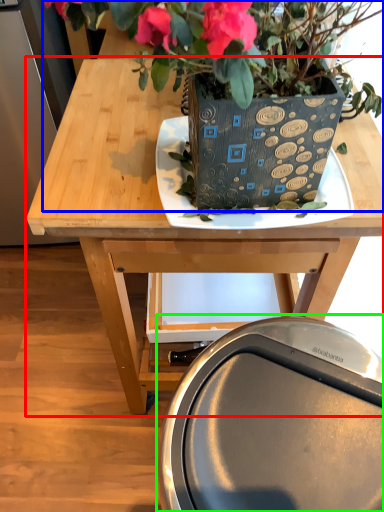
Question: Which is farther away from table (highlighted by a red box)? houseplant (highlighted by a blue box) or swivel chair (highlighted by a green box)?

Choices:
 (A) houseplant
 (B) swivel chair

Answer: (B)